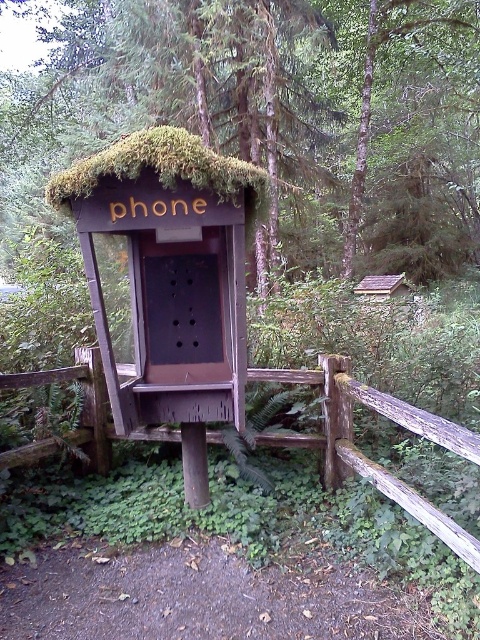
Consider the image. You are a painter planning to paint the green mossy roof at center and the brown wooden fence at center. Which object requires more paint considering their widths?

The green mossy roof at center requires more paint because its width surpasses that of the brown wooden fence at center.

Based on the photo, you are standing in front of the old phone booth surrounded by the wooden fence. There are two points marked on the ground near the booth. One is at coordinate point (222, 400) and the other at point (84, 372). Which point is closer to you?

Point (222, 400) is closer to the viewer than point (84, 372).

You are standing at the origin point of a coordinate system placed at the bottom left corner of the image. The wooden phone booth at center is located at coordinates approximately where?

The wooden phone booth at center is located at coordinates approximately at point (169, 269).